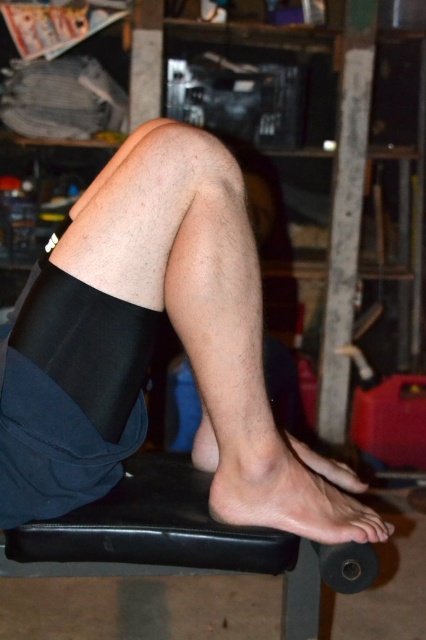
Does point (74, 280) come behind point (232, 218)?

That is True.

Who is positioned more to the right, black matte knee brace at center or hairless skin at center?

Positioned to the right is hairless skin at center.

Locate an element on the screen. The height and width of the screenshot is (640, 426). black matte knee brace at center is located at coordinates (149, 349).

Where is `black matte knee brace at center`? The image size is (426, 640). black matte knee brace at center is located at coordinates (149, 349).

Does black matte knee brace at center appear on the left side of skinny barefoot at lower center?

Correct, you'll find black matte knee brace at center to the left of skinny barefoot at lower center.

Between point (209, 397) and point (198, 444), which one is positioned behind?

The point (198, 444) is more distant.

Where is `black matte knee brace at center`? black matte knee brace at center is located at coordinates (149, 349).

Can you confirm if hairless skin at center is positioned to the right of black rubber stool at lower center?

Correct, you'll find hairless skin at center to the right of black rubber stool at lower center.

Does hairless skin at center have a smaller size compared to black rubber stool at lower center?

Actually, hairless skin at center might be larger than black rubber stool at lower center.

Identify the location of hairless skin at center. The height and width of the screenshot is (640, 426). (247, 384).